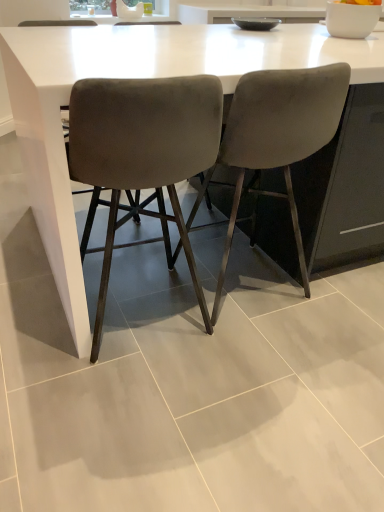
Describe the element at coordinates (276, 139) in the screenshot. I see `velvet grey chair at center, placed as the first chair when sorted from right to left` at that location.

Where is `white glossy table at center`? The image size is (384, 512). white glossy table at center is located at coordinates (134, 77).

From a real-world perspective, between velvet grey chair at center, the second chair when ordered from left to right, and velvet grey chair at center, the second chair in the right-to-left sequence, who is vertically higher?

velvet grey chair at center, the second chair when ordered from left to right, is physically above.

Based on their sizes in the image, would you say velvet grey chair at center, the second chair when ordered from left to right, is bigger or smaller than velvet grey chair at center, the second chair in the right-to-left sequence?

Considering their sizes, velvet grey chair at center, the second chair when ordered from left to right, takes up more space than velvet grey chair at center, the second chair in the right-to-left sequence.

Which is in front, velvet grey chair at center, the second chair when ordered from left to right, or velvet grey chair at center, which appears as the 1th chair when viewed from the left?

velvet grey chair at center, which appears as the 1th chair when viewed from the left.

Looking at their sizes, would you say velvet grey chair at center, placed as the first chair when sorted from right to left, is wider or thinner than velvet grey chair at center, which appears as the 1th chair when viewed from the left?

velvet grey chair at center, placed as the first chair when sorted from right to left, is wider than velvet grey chair at center, which appears as the 1th chair when viewed from the left.

How many degrees apart are the facing directions of velvet grey chair at center, the second chair when ordered from left to right, and white glossy table at center?

90.4 degrees separate the facing orientations of velvet grey chair at center, the second chair when ordered from left to right, and white glossy table at center.

Could you tell me if velvet grey chair at center, placed as the first chair when sorted from right to left, is turned towards white glossy table at center?

Yes, velvet grey chair at center, placed as the first chair when sorted from right to left, is oriented towards white glossy table at center.

Image resolution: width=384 pixels, height=512 pixels. Find the location of `the 1st chair counting from the left side of the white glossy table at center`. the 1st chair counting from the left side of the white glossy table at center is located at coordinates (276, 139).

From the image's perspective, would you say velvet grey chair at center, the second chair when ordered from left to right, is shown under white glossy table at center?

Indeed, from the image's perspective, velvet grey chair at center, the second chair when ordered from left to right, is shown beneath white glossy table at center.

In the scene shown: From a real-world perspective, between velvet grey chair at center, which appears as the 1th chair when viewed from the left, and velvet grey chair at center, the second chair when ordered from left to right, who is vertically higher?

velvet grey chair at center, the second chair when ordered from left to right.

Is velvet grey chair at center, which appears as the 1th chair when viewed from the left, next to velvet grey chair at center, placed as the first chair when sorted from right to left, and touching it?

No, velvet grey chair at center, which appears as the 1th chair when viewed from the left, is not next to velvet grey chair at center, placed as the first chair when sorted from right to left.

Which object is wider, velvet grey chair at center, which appears as the 1th chair when viewed from the left, or velvet grey chair at center, placed as the first chair when sorted from right to left?

With larger width is velvet grey chair at center, placed as the first chair when sorted from right to left.

Between velvet grey chair at center, which appears as the 1th chair when viewed from the left, and velvet grey chair at center, placed as the first chair when sorted from right to left, which one has more height?

velvet grey chair at center, placed as the first chair when sorted from right to left, is taller.

Is there a large distance between white glossy table at center and velvet grey chair at center, the second chair in the right-to-left sequence?

No, white glossy table at center is not far away from velvet grey chair at center, the second chair in the right-to-left sequence.

Between white glossy table at center and velvet grey chair at center, the second chair in the right-to-left sequence, which one has larger width?

With larger width is white glossy table at center.

Can you tell me how much white glossy table at center and velvet grey chair at center, the second chair in the right-to-left sequence, differ in facing direction?

The angle between the facing direction of white glossy table at center and the facing direction of velvet grey chair at center, the second chair in the right-to-left sequence, is 90.4 degrees.

From the image's perspective, which is above, white glossy table at center or velvet grey chair at center, the second chair in the right-to-left sequence?

white glossy table at center is shown above in the image.

Could you tell me if velvet grey chair at center, the second chair in the right-to-left sequence, is facing white glossy table at center?

Yes, velvet grey chair at center, the second chair in the right-to-left sequence, is oriented towards white glossy table at center.

Can you confirm if velvet grey chair at center, which appears as the 1th chair when viewed from the left, is bigger than white glossy table at center?

Incorrect, velvet grey chair at center, which appears as the 1th chair when viewed from the left, is not larger than white glossy table at center.

From the image's perspective, is velvet grey chair at center, which appears as the 1th chair when viewed from the left, located above or below white glossy table at center?

velvet grey chair at center, which appears as the 1th chair when viewed from the left, is below white glossy table at center.

Does point (136, 181) come farther from viewer compared to point (72, 239)?

No, it is not.

Between white glossy table at center and velvet grey chair at center, the second chair when ordered from left to right, which one has smaller size?

velvet grey chair at center, the second chair when ordered from left to right.

Is white glossy table at center facing towards velvet grey chair at center, the second chair when ordered from left to right?

No, white glossy table at center does not turn towards velvet grey chair at center, the second chair when ordered from left to right.

From the image's perspective, which one is positioned higher, white glossy table at center or velvet grey chair at center, the second chair when ordered from left to right?

white glossy table at center is shown above in the image.

Is white glossy table at center inside the boundaries of velvet grey chair at center, the second chair when ordered from left to right, or outside?

white glossy table at center is not inside velvet grey chair at center, the second chair when ordered from left to right, it's outside.

Locate an element on the screen. chair on the left of velvet grey chair at center, placed as the first chair when sorted from right to left is located at coordinates (143, 153).

Where is `table to the right of velvet grey chair at center, the second chair when ordered from left to right`? Image resolution: width=384 pixels, height=512 pixels. table to the right of velvet grey chair at center, the second chair when ordered from left to right is located at coordinates (134, 77).

Which object lies further to the anchor point velvet grey chair at center, the second chair in the right-to-left sequence, white glossy table at center or velvet grey chair at center, the second chair when ordered from left to right?

white glossy table at center is positioned further to the anchor velvet grey chair at center, the second chair in the right-to-left sequence.

From the image, which object appears to be nearer to white glossy table at center, velvet grey chair at center, placed as the first chair when sorted from right to left, or velvet grey chair at center, which appears as the 1th chair when viewed from the left?

velvet grey chair at center, which appears as the 1th chair when viewed from the left.

Looking at the image, which one is located further to velvet grey chair at center, the second chair when ordered from left to right, white glossy table at center or velvet grey chair at center, which appears as the 1th chair when viewed from the left?

white glossy table at center is further to velvet grey chair at center, the second chair when ordered from left to right.

Estimate the real-world distances between objects in this image. Which object is further from white glossy table at center, velvet grey chair at center, which appears as the 1th chair when viewed from the left, or velvet grey chair at center, placed as the first chair when sorted from right to left?

velvet grey chair at center, placed as the first chair when sorted from right to left, lies further to white glossy table at center than the other object.

From the image, which object appears to be nearer to velvet grey chair at center, placed as the first chair when sorted from right to left, velvet grey chair at center, which appears as the 1th chair when viewed from the left, or white glossy table at center?

The object closer to velvet grey chair at center, placed as the first chair when sorted from right to left, is velvet grey chair at center, which appears as the 1th chair when viewed from the left.

Based on the photo, when comparing their distances from velvet grey chair at center, which appears as the 1th chair when viewed from the left, does velvet grey chair at center, the second chair when ordered from left to right, or white glossy table at center seem closer?

Among the two, velvet grey chair at center, the second chair when ordered from left to right, is located nearer to velvet grey chair at center, which appears as the 1th chair when viewed from the left.

Find the location of a particular element. This screenshot has width=384, height=512. chair located between velvet grey chair at center, which appears as the 1th chair when viewed from the left, and white glossy table at center in the left-right direction is located at coordinates (276, 139).